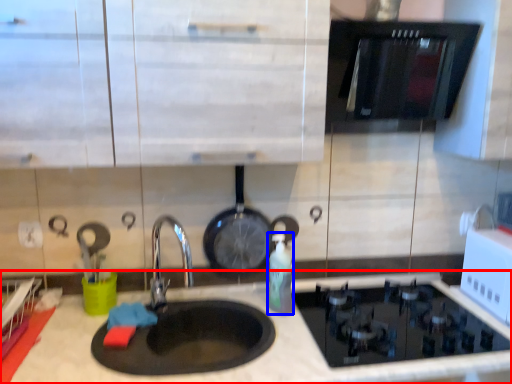
Question: Which object appears closest to the camera in this image, countertop (highlighted by a red box) or bottle (highlighted by a blue box)?

Choices:
 (A) countertop
 (B) bottle

Answer: (A)